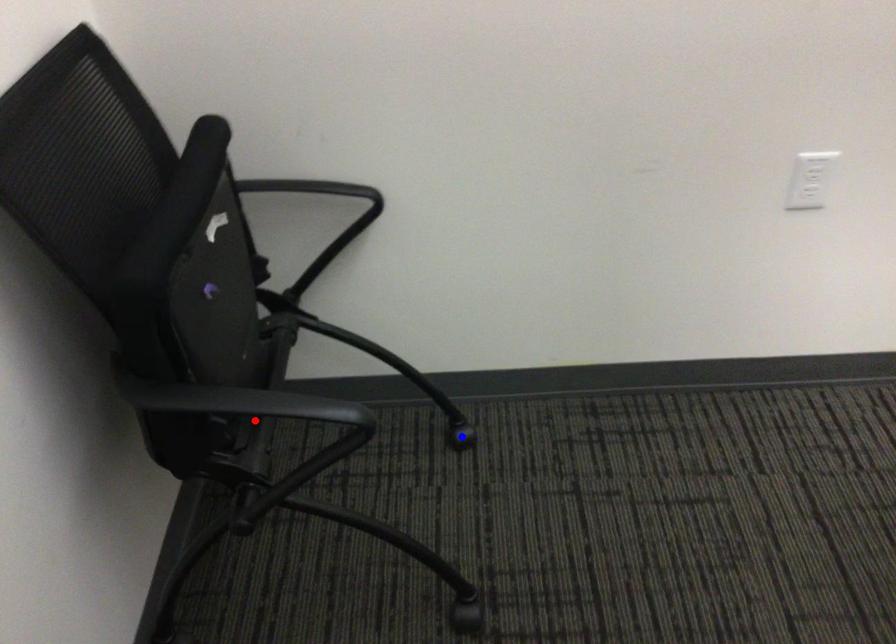
Question: In the image, two points are highlighted. Which point is nearer to the camera? Reply with the corresponding letter.

Choices:
 (A) blue point
 (B) red point

Answer: (B)